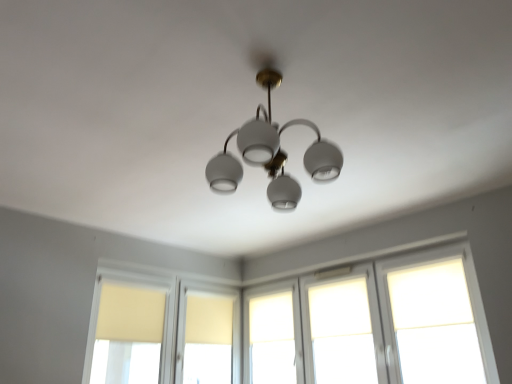
Question: From the image's perspective, relative to beige fabric curtain at lower left, is matte yellow curtain at left, the first window from the left, above or below?

Choices:
 (A) above
 (B) below

Answer: (B)

Question: Based on their sizes in the image, would you say matte yellow curtain at left, the sixth window in the right-to-left sequence, is bigger or smaller than beige fabric curtain at lower left?

Choices:
 (A) big
 (B) small

Answer: (A)

Question: Which object is positioned closest to the matte yellow curtain at left, the sixth window in the right-to-left sequence?

Choices:
 (A) translucent glass window at center, which ranks as the 5th window in left-to-right order
 (B) white matte glass window at upper right, which ranks as the sixth window in left-to-right order
 (C) beige fabric curtain at lower left
 (D) matte yellow window at center, placed as the second window when sorted from left to right
 (E) white matte window at center, the fourth window from the left

Answer: (C)

Question: Estimate the real-world distances between objects in this image. Which object is closer to the matte yellow window at center, placed as the 5th window when sorted from right to left?

Choices:
 (A) matte yellow curtain at left, the first window from the left
 (B) white matte glass window at upper right, which is counted as the 1th window, starting from the right
 (C) white matte window at center, the 3th window from the right
 (D) white matte window at center, the fourth window positioned from the right
 (E) beige fabric curtain at lower left

Answer: (D)